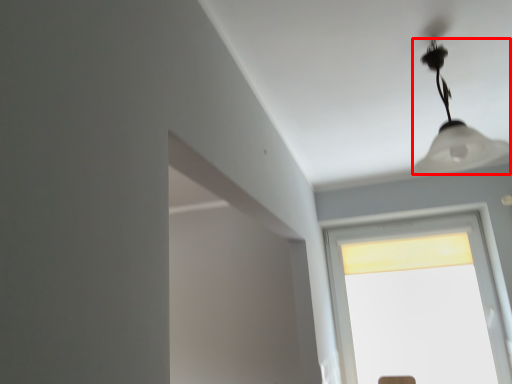
Question: From the image's perspective, where is lamp (annotated by the red box) located in relation to window in the image?

Choices:
 (A) below
 (B) above

Answer: (B)